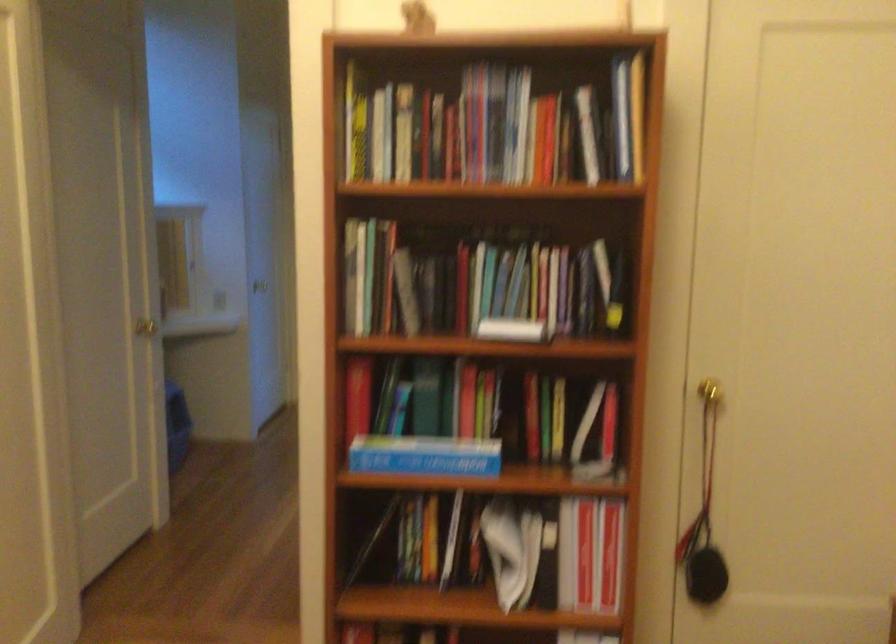
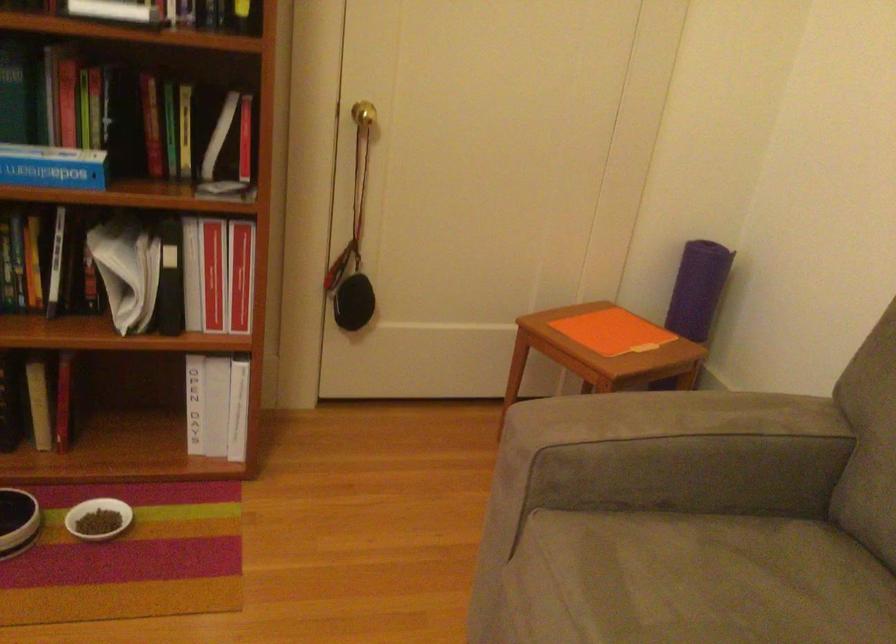
In a continuous first-person perspective shot, in which direction is the camera moving?

The cameraman moved toward right, forward.